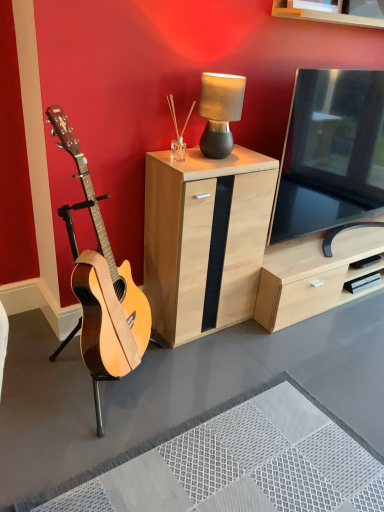
Where is `free space in front of light wood/black panel cabinet at center`? The width and height of the screenshot is (384, 512). free space in front of light wood/black panel cabinet at center is located at coordinates (230, 365).